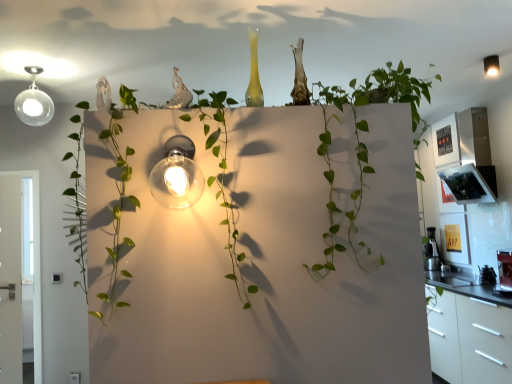
Question: Looking at the image, does matte black light fixture at upper right, which is counted as the second light fixture, starting from the bottom, seem bigger or smaller compared to metallic silver coffee maker at right?

Choices:
 (A) small
 (B) big

Answer: (A)

Question: Considering the positions of matte black light fixture at upper right, marked as the 1th light fixture in a right-to-left arrangement, and metallic silver coffee maker at right in the image, is matte black light fixture at upper right, marked as the 1th light fixture in a right-to-left arrangement, wider or thinner than metallic silver coffee maker at right?

Choices:
 (A) wide
 (B) thin

Answer: (B)

Question: Which object is positioned farthest from the white glossy cabinet at right?

Choices:
 (A) metallic silver coffee maker at right
 (B) matte black light fixture at upper right, which is counted as the second light fixture, starting from the bottom
 (C) clear glass light fixture at center, placed as the second light fixture when sorted from right to left

Answer: (C)

Question: Estimate the real-world distances between objects in this image. Which object is closer to the clear glass light fixture at center, the 1th light fixture from the bottom?

Choices:
 (A) metallic silver coffee maker at right
 (B) white glossy cabinet at right
 (C) matte black light fixture at upper right, which is counted as the second light fixture, starting from the bottom

Answer: (B)